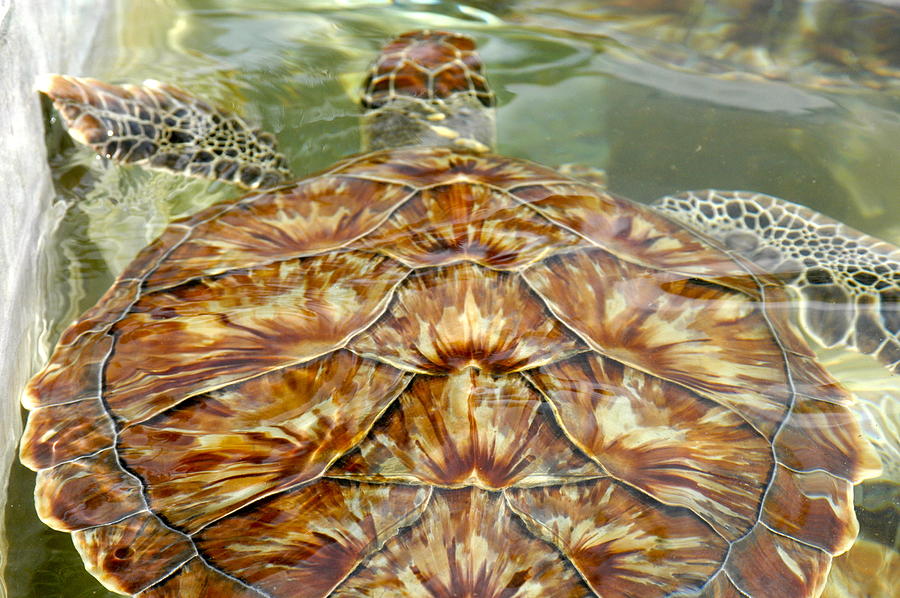
Find the location of a particular element. The image size is (900, 598). wall is located at coordinates (16, 45).